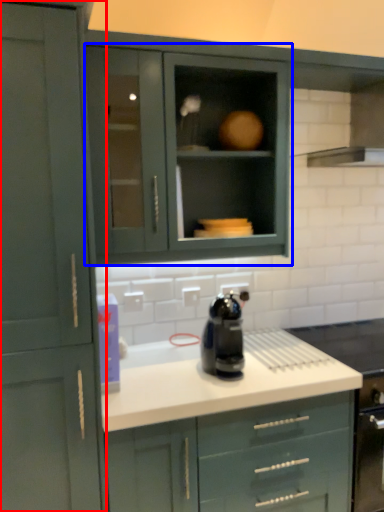
Question: Which point is further to the camera, cabinetry (highlighted by a red box) or cabinetry (highlighted by a blue box)?

Choices:
 (A) cabinetry
 (B) cabinetry

Answer: (B)